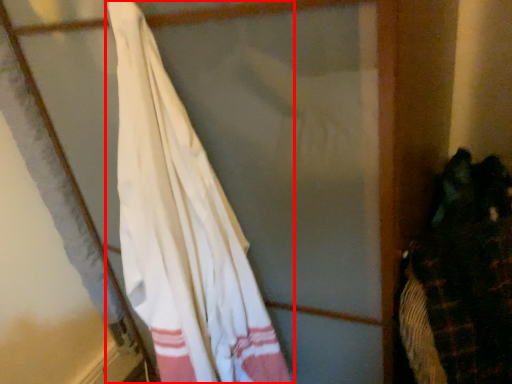
Question: From the image's perspective, what is the correct spatial relationship of curtain (annotated by the red box) in relation to laundry?

Choices:
 (A) below
 (B) above

Answer: (B)